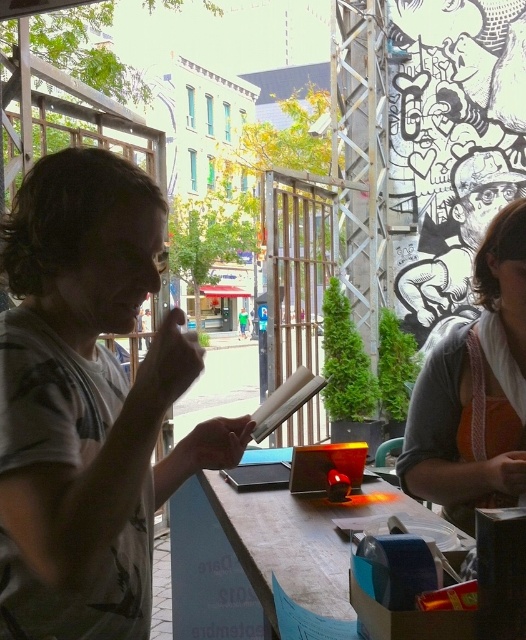
In the scene shown: You are standing in the outdoor scene and want to move from the point closer to you to the farther point. Which path should you take to go from point (429, 468) to point (227, 593)?

The path from point (429, 468) to point (227, 593) should be taken by moving towards the right and downward since point (429, 468) is closer to the viewer than point (227, 593).